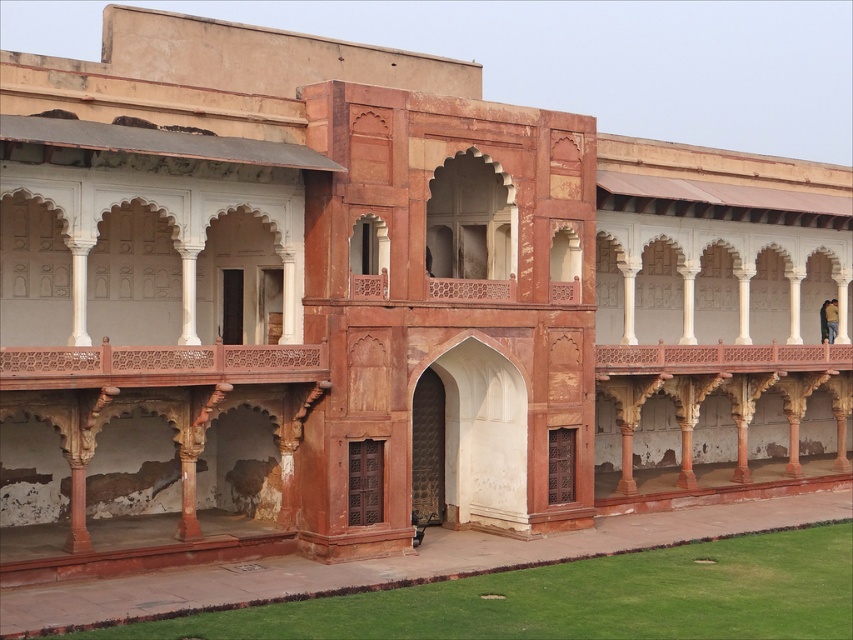
You are an architect planning to install a decorative railing on both the carved wood balcony at center and the rustic wood balcony at upper center. Which balcony requires a narrower railing due to its dimensions?

The carved wood balcony at center requires a narrower railing because it has a lesser width compared to the rustic wood balcony at upper center.

You are standing in front of the historical building and want to take a photo of both the carved wood balcony at center and the rustic wood balcony at upper center. Which balcony should you focus on first to ensure both are in frame?

You should focus on the carved wood balcony at center first because it is closer to the viewer, allowing you to adjust the camera angle to include both balconies in the frame.